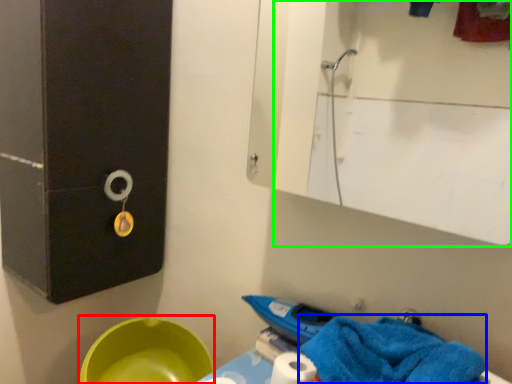
Question: Considering the real-world distances, which object is closest to basin (highlighted by a red box)? bath towel (highlighted by a blue box) or mirror (highlighted by a green box).

Choices:
 (A) bath towel
 (B) mirror

Answer: (A)